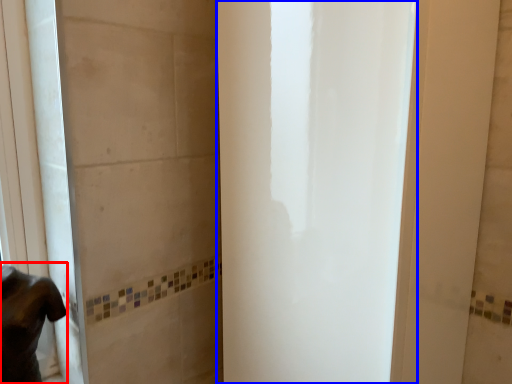
Question: Which object is closer to the camera taking this photo, person (highlighted by a red box) or screen door (highlighted by a blue box)?

Choices:
 (A) person
 (B) screen door

Answer: (B)